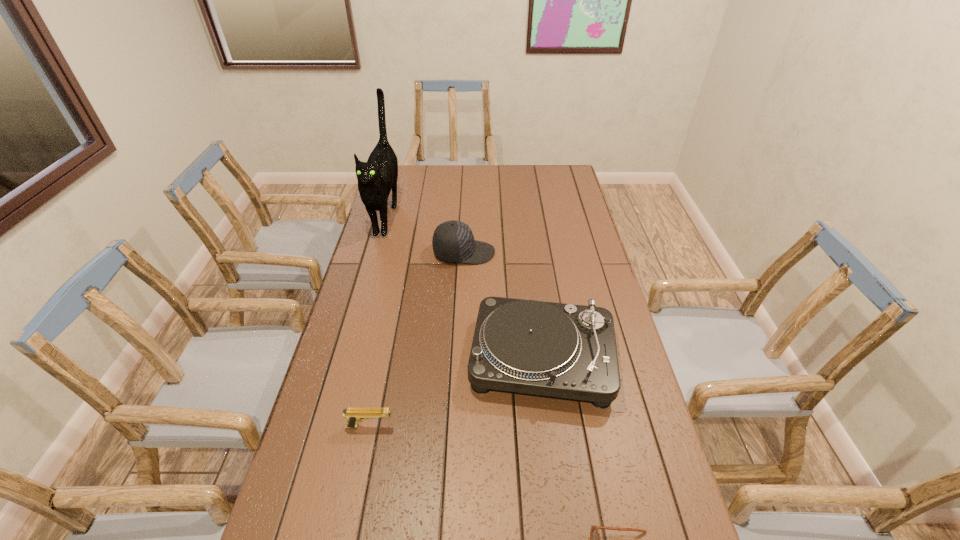
Where is `cat that is at the left edge`? This screenshot has width=960, height=540. cat that is at the left edge is located at coordinates (376, 177).

This screenshot has height=540, width=960. I want to click on pistol situated at the left edge, so click(353, 415).

This screenshot has height=540, width=960. Identify the location of object that is at the right edge. (560, 350).

Where is `object present at the far left corner`? Image resolution: width=960 pixels, height=540 pixels. object present at the far left corner is located at coordinates (376, 177).

In the image, there is a desktop. Where is `blank space at the far edge`? This screenshot has width=960, height=540. blank space at the far edge is located at coordinates coord(494,179).

In the image, there is a desktop. Where is `vacant region at the left edge`? The image size is (960, 540). vacant region at the left edge is located at coordinates (348, 318).

Locate an element on the screen. The height and width of the screenshot is (540, 960). vacant point at the right edge is located at coordinates (575, 250).

This screenshot has width=960, height=540. Find the location of `free point between the baseball cap and the tallest object`. free point between the baseball cap and the tallest object is located at coordinates (425, 234).

The image size is (960, 540). I want to click on vacant area between the baseball cap and the cat, so click(x=425, y=234).

Locate an element on the screen. The width and height of the screenshot is (960, 540). free spot between the cat and the baseball cap is located at coordinates point(425,234).